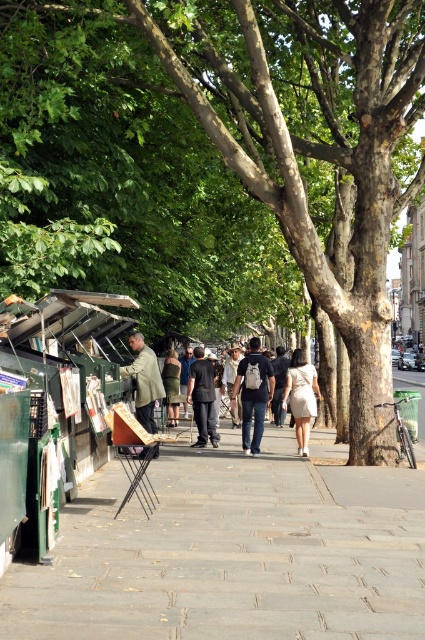
Does brown rough tree at center have a larger size compared to gray concrete pavement at center?

Yes, brown rough tree at center is bigger than gray concrete pavement at center.

The width and height of the screenshot is (425, 640). Describe the element at coordinates (218, 160) in the screenshot. I see `brown rough tree at center` at that location.

Find the location of a particular element. The height and width of the screenshot is (640, 425). brown rough tree at center is located at coordinates (218, 160).

Which of these two, green matte jacket at left or white cotton dress at center, stands taller?

white cotton dress at center

Who is more distant from viewer, [135,404] or [297,392]?

The point [297,392] is behind.

Locate an element on the screen. The width and height of the screenshot is (425, 640). green matte jacket at left is located at coordinates [144, 380].

The height and width of the screenshot is (640, 425). I want to click on dark blue jeans at center, so click(x=252, y=394).

Is dark blue jeans at center to the right of white cotton dress at center from the viewer's perspective?

Incorrect, dark blue jeans at center is not on the right side of white cotton dress at center.

Which is in front, point (269, 380) or point (300, 432)?

Positioned in front is point (269, 380).

The image size is (425, 640). In order to click on dark blue jeans at center in this screenshot , I will do `click(252, 394)`.